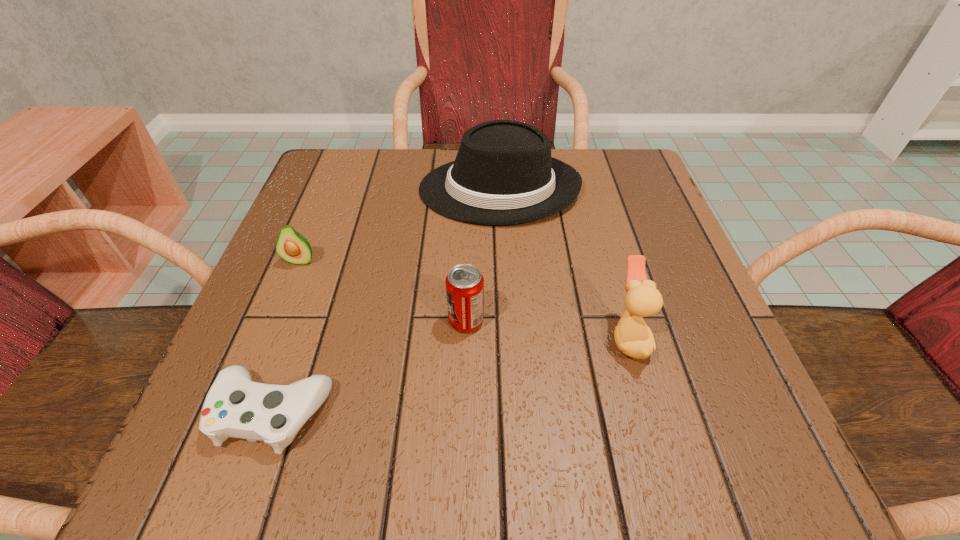
At what (x,y) coordinates should I click in order to perform the action: click on duck that is positioned at the right edge. Please return your answer as a coordinate pair (x, y). Looking at the image, I should click on (633, 337).

You are a GUI agent. You are given a task and a screenshot of the screen. Output one action in this format:
    pyautogui.click(x=<x>, y=<y>)
    Task: Click on the object that is at the near left corner
    
    Given the screenshot: What is the action you would take?
    pyautogui.click(x=235, y=406)

Where is `object that is at the far right corner`? object that is at the far right corner is located at coordinates (503, 174).

Where is `vacant space at the far edge`? Image resolution: width=960 pixels, height=540 pixels. vacant space at the far edge is located at coordinates (424, 174).

What are the coordinates of `free space at the near edge of the desktop` in the screenshot? It's located at (584, 476).

Identify the location of vacant space at the left edge of the desktop. This screenshot has width=960, height=540. (318, 241).

In the image, there is a desktop. Identify the location of vacant space at the right edge. The image size is (960, 540). (698, 371).

I want to click on vacant space at the far left corner of the desktop, so click(x=326, y=184).

Where is `free space at the near left corner of the desktop`? The image size is (960, 540). free space at the near left corner of the desktop is located at coordinates (316, 429).

The image size is (960, 540). In order to click on vacant space at the far right corner of the desktop in this screenshot , I will do `click(636, 201)`.